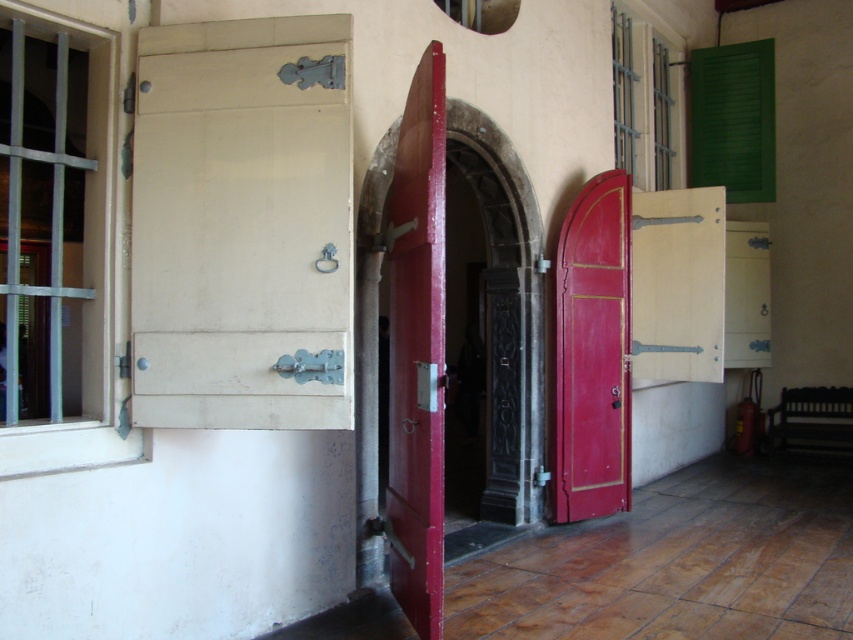
Question: Is glossy wood door at center right positioned at the back of metallic silver shutter at upper right?

Choices:
 (A) yes
 (B) no

Answer: (B)

Question: Can you confirm if glossy wood door at center right is wider than green matte shutter at upper right?

Choices:
 (A) no
 (B) yes

Answer: (A)

Question: Where is glossy wood door at center right located in relation to metallic silver shutter at upper right in the image?

Choices:
 (A) right
 (B) left

Answer: (B)

Question: Which object is farther from the camera taking this photo?

Choices:
 (A) metallic silver shutter at upper right
 (B) glossy wood door at center right
 (C) smooth red door at center

Answer: (A)

Question: Among these points, which one is farthest from the camera?

Choices:
 (A) (643, 172)
 (B) (741, 102)
 (C) (579, 353)

Answer: (B)

Question: Which of the following is the farthest from the observer?

Choices:
 (A) glossy wood door at center right
 (B) smooth red door at center
 (C) green matte shutter at upper right

Answer: (C)